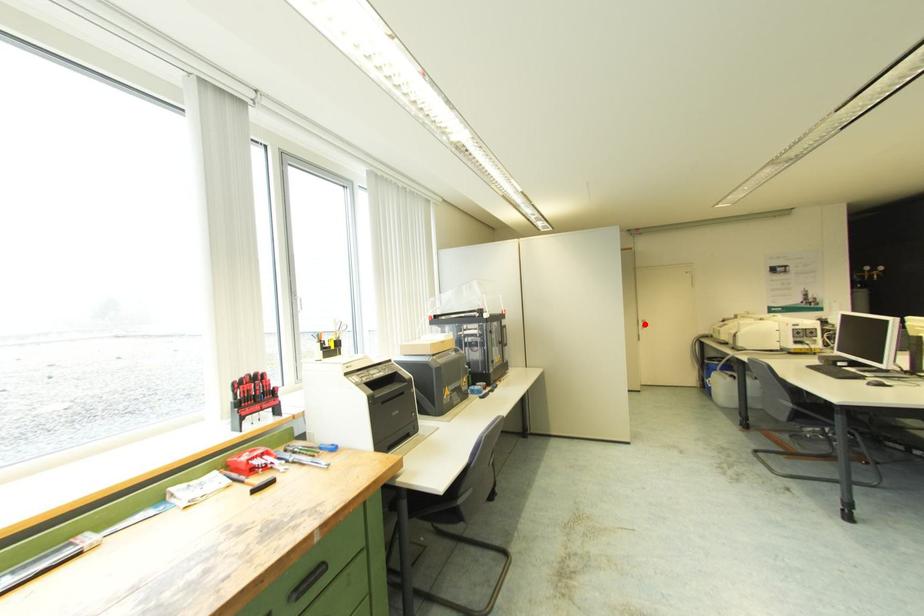
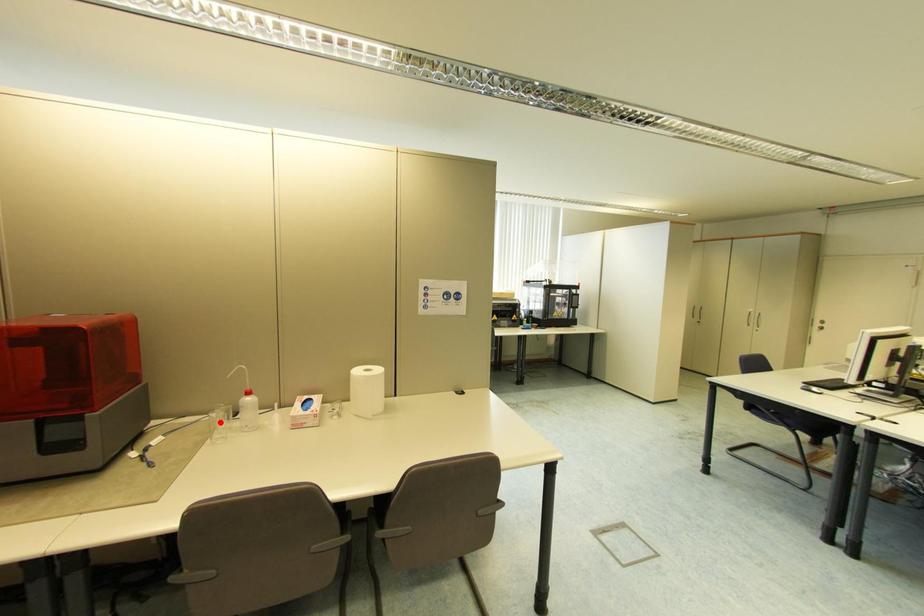
I am providing you with two images of the same scene from different viewpoints. A red point is marked on the first image and another point is marked on the second image. Does the point marked in image1 correspond to the same location as the one in image2?

No